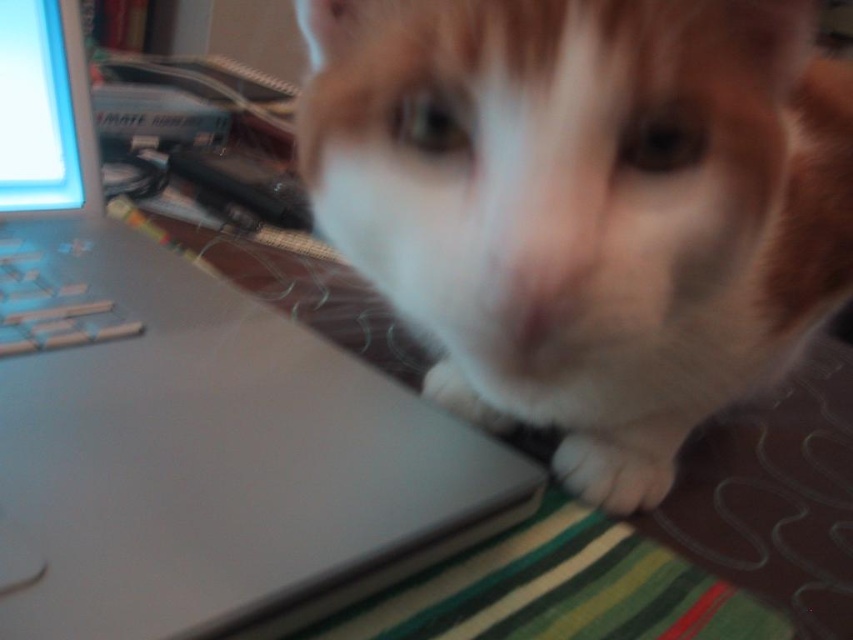
Between white fur cat at center and white fur paw at lower center, which one appears on the right side from the viewer's perspective?

From the viewer's perspective, white fur paw at lower center appears more on the right side.

Consider the image. Who is positioned more to the left, white fur cat at center or white fur paw at lower center?

white fur cat at center is more to the left.

Which is behind, point (718, 76) or point (561, 467)?

Positioned behind is point (561, 467).

Locate an element on the screen. The height and width of the screenshot is (640, 853). white fur cat at center is located at coordinates (585, 193).

Who is more forward, [100,490] or [663,467]?

Point [100,490] is in front.

Is matte silver laptop at upper left positioned before white fur paw at lower center?

Yes, it is.

Measure the distance between point (325, 369) and camera.

Point (325, 369) and camera are 14.78 inches apart from each other.

Identify the location of matte silver laptop at upper left. This screenshot has height=640, width=853. (187, 413).

Between white fur cat at center and satin silver keys at lower left, which one appears on the right side from the viewer's perspective?

white fur cat at center is more to the right.

Can you confirm if white fur cat at center is taller than satin silver keys at lower left?

Indeed, white fur cat at center has a greater height compared to satin silver keys at lower left.

Identify the location of white fur cat at center. The height and width of the screenshot is (640, 853). (585, 193).